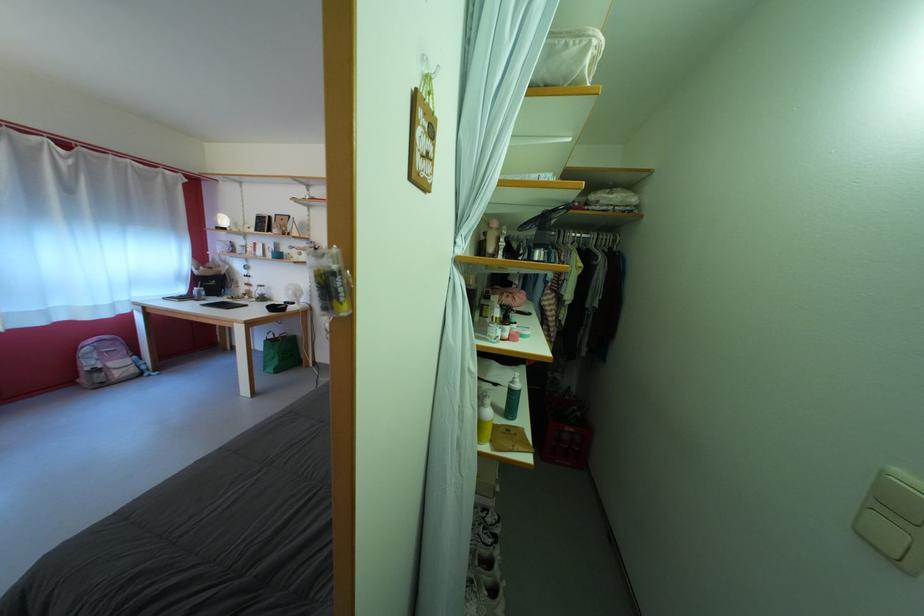
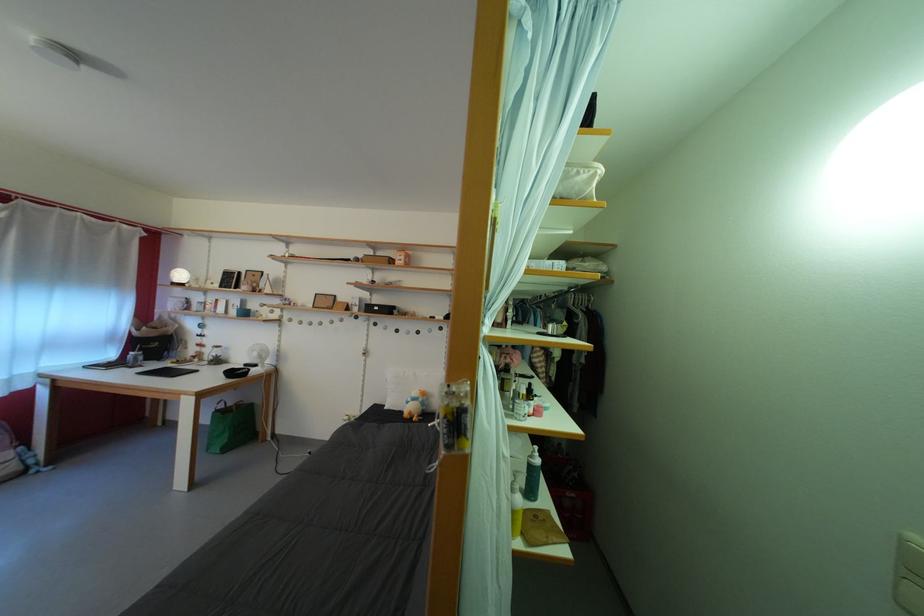
Where in the second image is the point corresponding to (x=293, y=254) from the first image?

(261, 312)